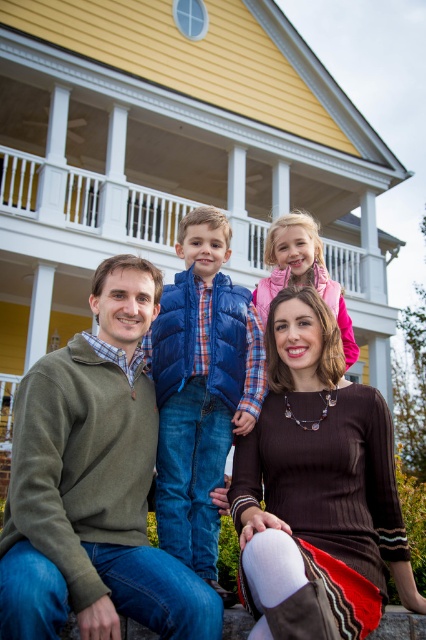
Does brown knitted sweater at center lie in front of blue puffy vest at center?

That is True.

Which is behind, point (302, 353) or point (215, 256)?

The point (215, 256) is more distant.

Describe the element at coordinates (319, 477) in the screenshot. I see `brown knitted sweater at center` at that location.

Where is `brown knitted sweater at center`? This screenshot has height=640, width=426. brown knitted sweater at center is located at coordinates (319, 477).

How much distance is there between brown knitted sweater at center and white wooden porch at upper center?

brown knitted sweater at center and white wooden porch at upper center are 19.86 meters apart from each other.

Can you confirm if brown knitted sweater at center is positioned above white wooden porch at upper center?

Actually, brown knitted sweater at center is below white wooden porch at upper center.

Does point (267, 339) come closer to viewer compared to point (342, 243)?

Yes, it is in front of point (342, 243).

The width and height of the screenshot is (426, 640). In order to click on brown knitted sweater at center in this screenshot , I will do `click(319, 477)`.

Which is in front, point (198, 582) or point (92, 200)?

Point (198, 582) is more forward.

Where is `blue fleece vest at upper center`? The width and height of the screenshot is (426, 640). blue fleece vest at upper center is located at coordinates (94, 484).

Identify the location of blue fleece vest at upper center. Image resolution: width=426 pixels, height=640 pixels. (94, 484).